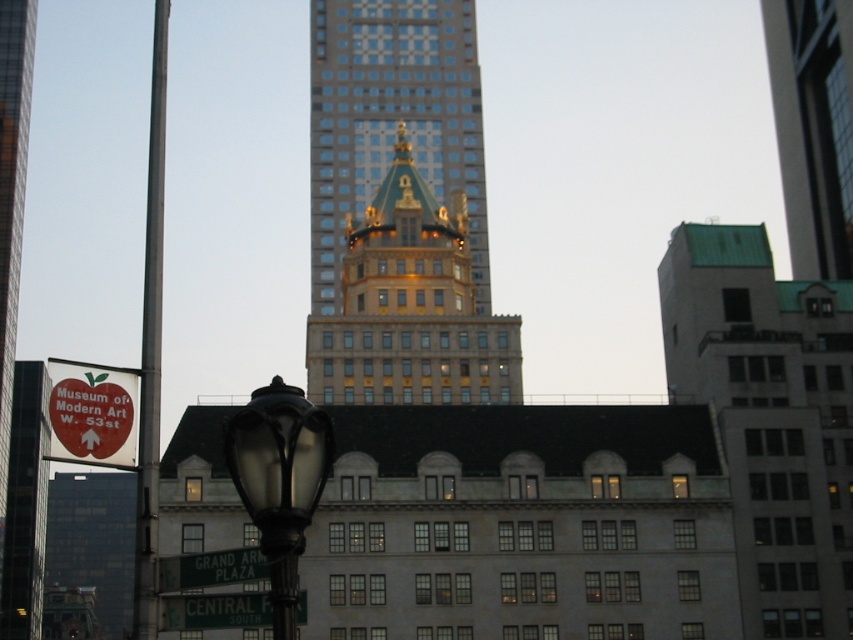
Measure the distance from green matte street sign at lower center to greensignboardstreet sign at lower center.

green matte street sign at lower center is 78.55 centimeters from greensignboardstreet sign at lower center.

Who is positioned more to the right, green matte street sign at lower center or greensignboardstreet sign at lower center?

green matte street sign at lower center is more to the right.

Which is behind, point (224, 609) or point (213, 580)?

The point (224, 609) is behind.

At what (x,y) coordinates should I click in order to perform the action: click on green matte street sign at lower center. Please return your answer as a coordinate pair (x, y). The image size is (853, 640). Looking at the image, I should click on (215, 611).

Between metallic glass skyscraper at upper right and matte black streetlight at lower left, which one appears on the right side from the viewer's perspective?

From the viewer's perspective, metallic glass skyscraper at upper right appears more on the right side.

Which is below, metallic glass skyscraper at upper right or matte black streetlight at lower left?

matte black streetlight at lower left is lower down.

The height and width of the screenshot is (640, 853). Describe the element at coordinates (813, 129) in the screenshot. I see `metallic glass skyscraper at upper right` at that location.

Where is `metallic glass skyscraper at upper right`? Image resolution: width=853 pixels, height=640 pixels. metallic glass skyscraper at upper right is located at coordinates (813, 129).

Does gold/golden stone tower at center have a greater height compared to matte black streetlight at lower left?

Yes.

This screenshot has height=640, width=853. Describe the element at coordinates (392, 120) in the screenshot. I see `gold/golden stone tower at center` at that location.

The width and height of the screenshot is (853, 640). Identify the location of gold/golden stone tower at center. (392, 120).

Find the location of `gold/golden stone tower at center`. gold/golden stone tower at center is located at coordinates (392, 120).